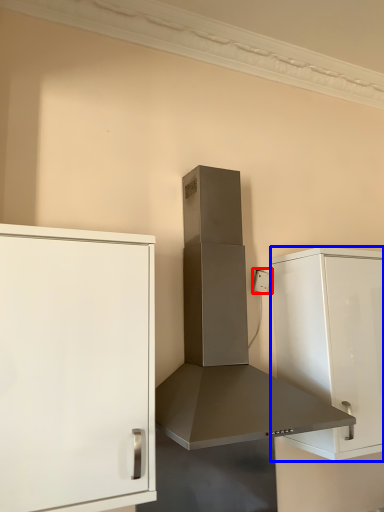
Question: Among these objects, which one is farthest to the camera, electric outlet (highlighted by a red box) or cabinetry (highlighted by a blue box)?

Choices:
 (A) electric outlet
 (B) cabinetry

Answer: (A)